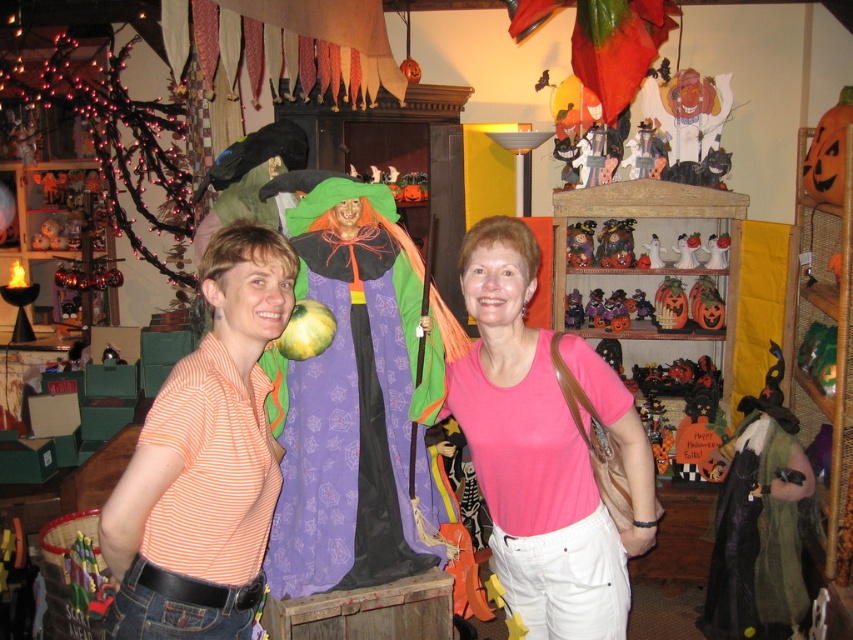
You are a photographer setting up for a Halloween photo shoot. You need to ensure that the pink cotton shirt at center and the matte plastic pumpkin at center are both visible in the frame. Based on their positions, which object is closer to the camera?

The pink cotton shirt at center is positioned under the matte plastic pumpkin at center, so the pumpkin is closer to the camera than the shirt.

You are standing at the origin point in the image and want to reach the point labeled as point (592, 257). However, there is an obstacle at point (305, 442). Will you be able to reach your destination without going around the obstacle?

Since point (305, 442) is in front of point (592, 257), you will encounter the obstacle first. To reach your destination, you will need to go around the obstacle.

You are organizing a Halloween party and want to place the matte plastic pumpkin at center on a shelf. The shelf can only hold items smaller than the pink cotton shirt at center. Can the pumpkin fit on the shelf?

The matte plastic pumpkin at center is smaller than the pink cotton shirt at center, so it can fit on the shelf.